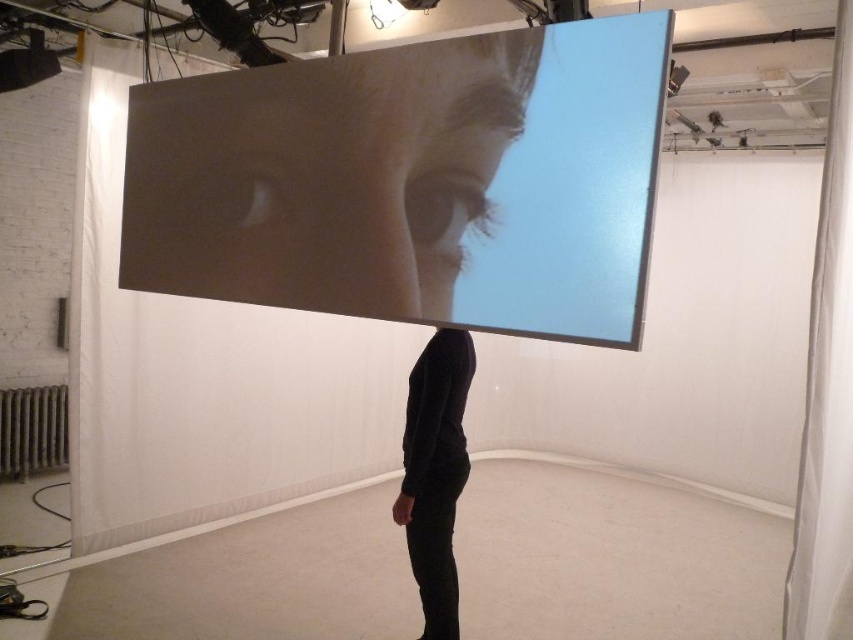
Consider the image. Does smooth skin at upper center have a greater width compared to black matte shirt at center?

Correct, the width of smooth skin at upper center exceeds that of black matte shirt at center.

Is smooth skin at upper center further to camera compared to black matte shirt at center?

No, it is in front of black matte shirt at center.

You are a GUI agent. You are given a task and a screenshot of the screen. Output one action in this format:
    pyautogui.click(x=<x>, y=<y>)
    Task: Click on the smooth skin at upper center
    
    Given the screenshot: What is the action you would take?
    pyautogui.click(x=323, y=176)